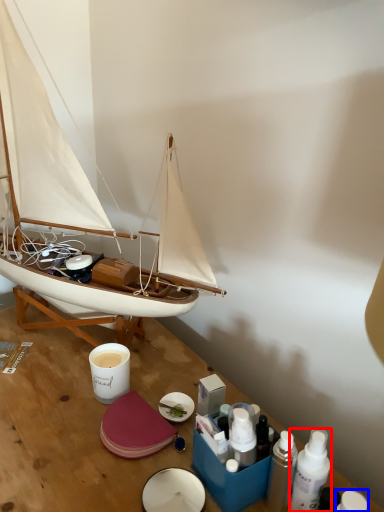
Question: Which object is closer to the camera taking this photo, toiletry (highlighted by a red box) or toiletry (highlighted by a blue box)?

Choices:
 (A) toiletry
 (B) toiletry

Answer: (B)